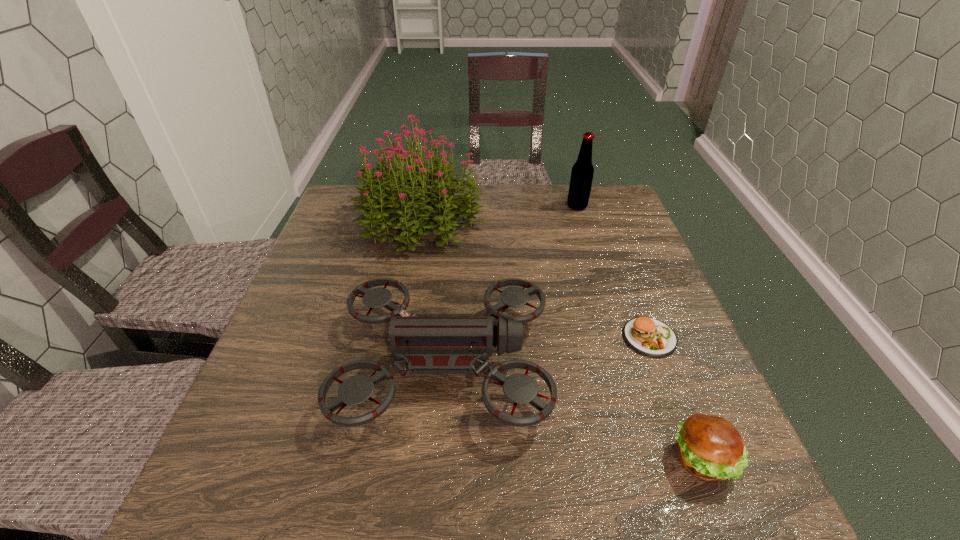
Where is `vacant space at the far edge of the desktop`? This screenshot has width=960, height=540. vacant space at the far edge of the desktop is located at coordinates click(539, 219).

Where is `vacant area at the near edge of the desktop`? The image size is (960, 540). vacant area at the near edge of the desktop is located at coordinates (529, 503).

You are a GUI agent. You are given a task and a screenshot of the screen. Output one action in this format:
    pyautogui.click(x=<x>, y=<y>)
    Task: Click on the free space at the left edge of the desktop
    The height and width of the screenshot is (540, 960).
    Given the screenshot: What is the action you would take?
    pyautogui.click(x=260, y=413)

This screenshot has width=960, height=540. I want to click on vacant space at the right edge, so click(x=658, y=289).

Locate an element on the screen. This screenshot has width=960, height=540. vacant space at the far left corner of the desktop is located at coordinates (343, 217).

The image size is (960, 540). I want to click on vacant area that lies between the third shortest object and the second shortest object, so click(574, 411).

Where is `blank region between the beer bottle and the patty`? Image resolution: width=960 pixels, height=540 pixels. blank region between the beer bottle and the patty is located at coordinates tap(613, 272).

At what (x,y) coordinates should I click in order to perform the action: click on vacant space that is in between the patty and the drone. Please return your answer as a coordinate pair (x, y). This screenshot has height=540, width=960. Looking at the image, I should click on (547, 350).

At what (x,y) coordinates should I click in order to perform the action: click on free space that is in between the fourth shortest object and the bouquet. Please return your answer as a coordinate pair (x, y). This screenshot has width=960, height=540. Looking at the image, I should click on (499, 212).

Locate an element on the screen. The width and height of the screenshot is (960, 540). empty space that is in between the bouquet and the beer bottle is located at coordinates (499, 212).